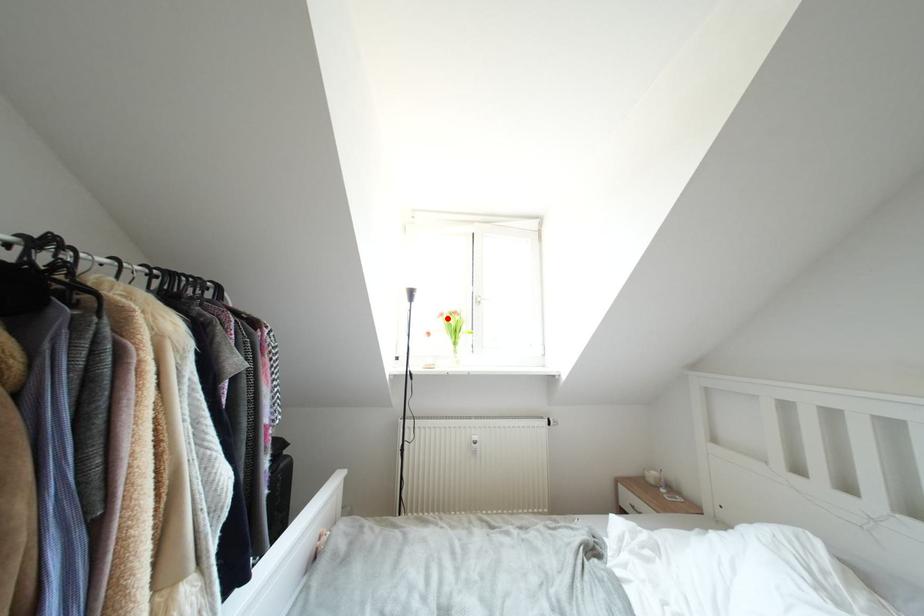
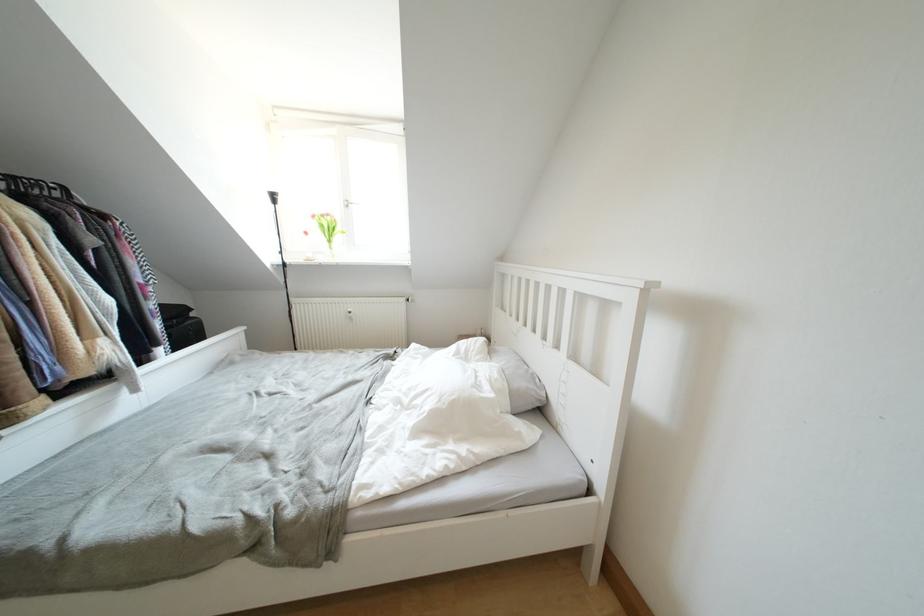
Find the pixel in the second image that matches the highlighted location in the first image.

(319, 220)